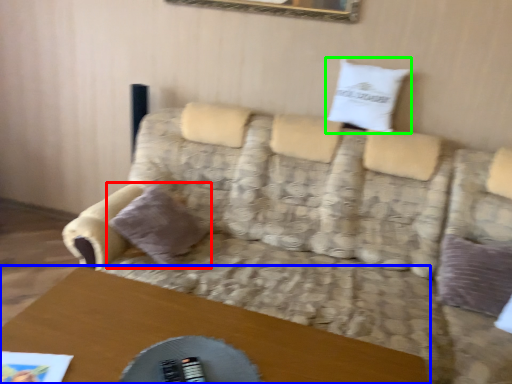
Question: Estimate the real-world distances between objects in this image. Which object is farther from pillow (highlighted by a red box), table (highlighted by a blue box) or pillow (highlighted by a green box)?

Choices:
 (A) table
 (B) pillow

Answer: (B)